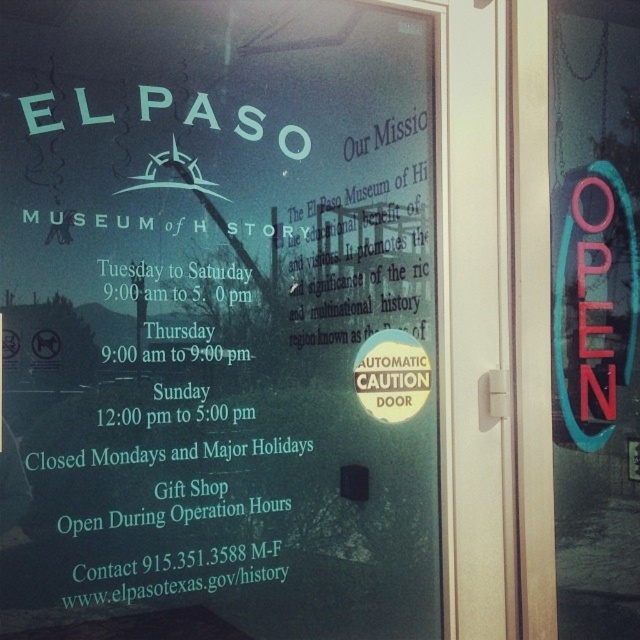
Question: Which point appears closest to the camera in this image?

Choices:
 (A) (579, 164)
 (B) (166, 536)

Answer: (B)

Question: Is transparent glass sign at upper center wider than neon sign at right?

Choices:
 (A) yes
 (B) no

Answer: (A)

Question: Can you confirm if transparent glass sign at upper center is bigger than neon sign at right?

Choices:
 (A) no
 (B) yes

Answer: (B)

Question: Is transparent glass sign at upper center smaller than neon sign at right?

Choices:
 (A) no
 (B) yes

Answer: (A)